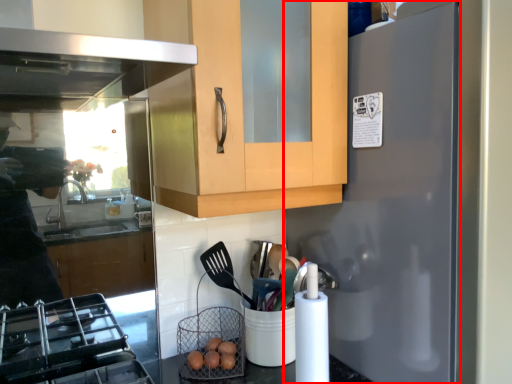
Question: From the image's perspective, considering the relative positions of refrigerator (annotated by the red box) and basket in the image provided, where is refrigerator (annotated by the red box) located with respect to the staircase?

Choices:
 (A) above
 (B) below

Answer: (A)